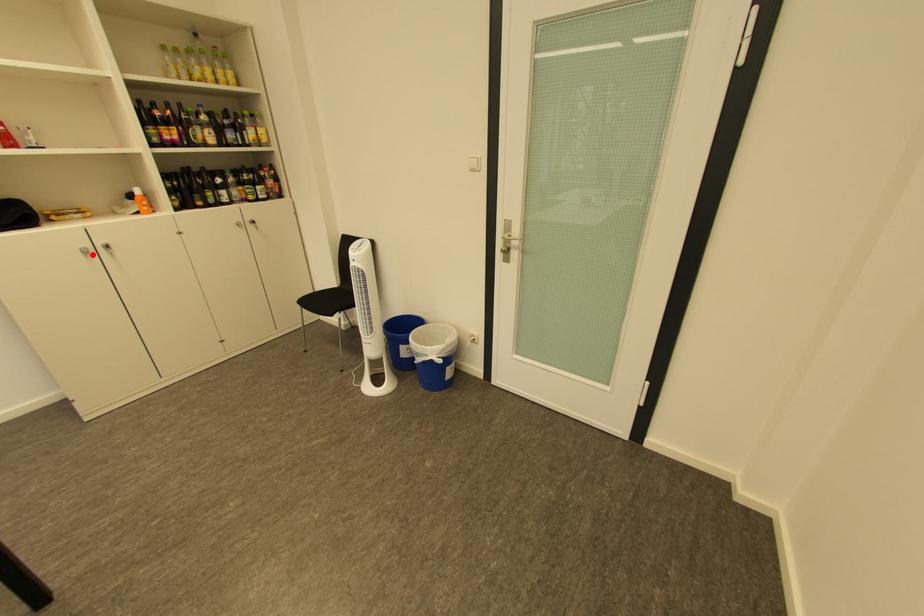
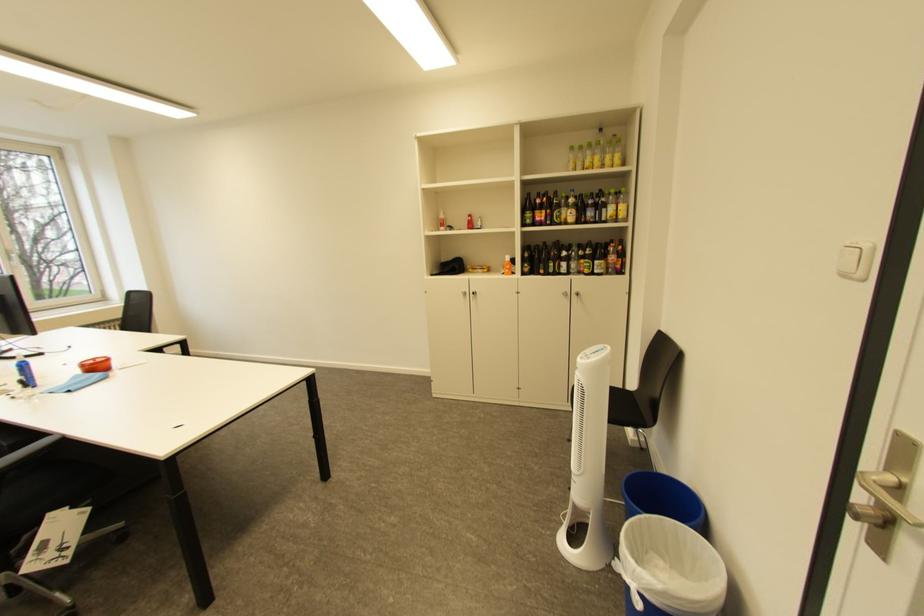
Question: I am providing you with two images of the same scene from different viewpoints. Image1 has a red point marked. In image2, the corresponding 3D location appears at what relative position? Reply with the corresponding letter.

Choices:
 (A) Closer
 (B) Farther

Answer: (A)